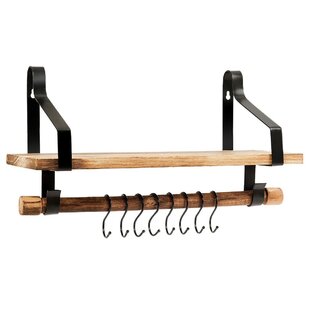
Find the location of `7th black hook`. 7th black hook is located at coordinates (181, 230).